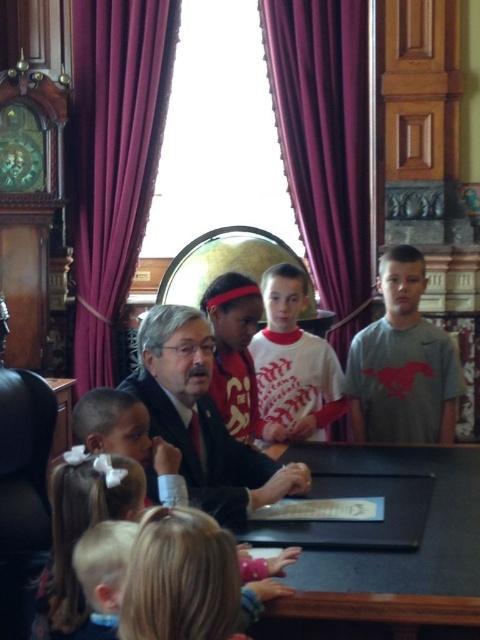
You are a photographer taking a group photo of the black suit at center and the blonde hair with bow at lower left. Which object should you focus on first to ensure they are both in frame?

You should focus on the black suit at center first because it is wider than the blonde hair with bow at lower left, so it requires more space in the frame.

You are a photographer setting up for a group photo. You need to position yourself so that both the purple velvet curtain at left and the purple velvet curtain at upper center are in your frame. Which curtain should you move closer to the camera to ensure both are visible without moving the camera?

The purple velvet curtain at left is already closer to the viewer than the purple velvet curtain at upper center. To ensure both are visible without moving the camera, you should move the purple velvet curtain at upper center closer to the camera so it aligns with the distance of the purple velvet curtain at left.